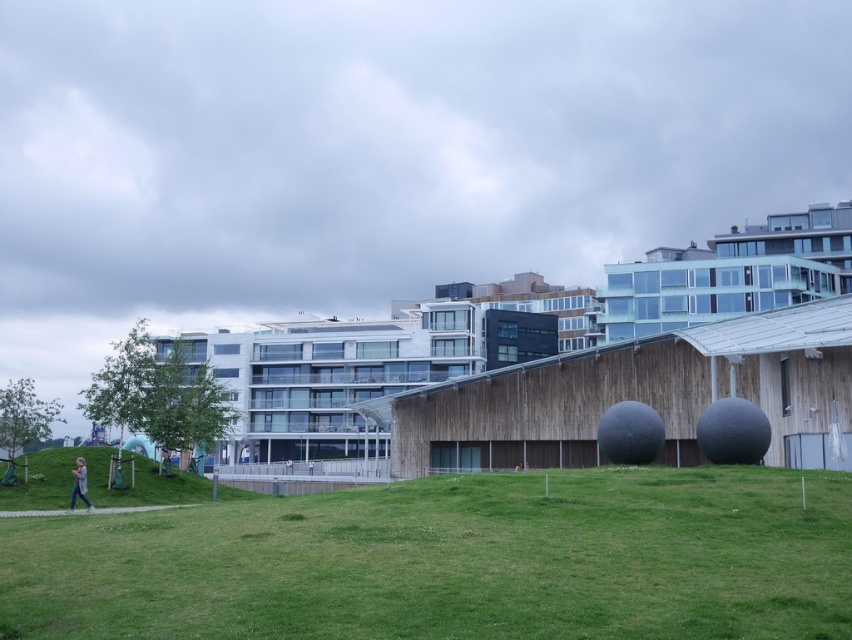
You are standing at the base of the green grassy hillside at lower left and the light blue jeans at lower left. Which one is higher in elevation?

The green grassy hillside at lower left is taller than the light blue jeans at lower left, so the hillside is higher in elevation.

You are planning to set up a picnic area in the urban landscape. Which area would be more suitable for a larger picnic blanket, the green grass at center or the green grassy hillside at lower left?

The green grass at center has a larger width than the green grassy hillside at lower left, making it more suitable for a larger picnic blanket.

Based on the photo, you are a gardener who needs to mow the lawn. You see the green grass at center and the light blue jeans at lower left. Which area requires immediate attention based on their heights?

The green grass at center requires immediate attention because it has a lesser height compared to the light blue jeans at lower left, indicating it might have been recently mowed and needs less urgent care.